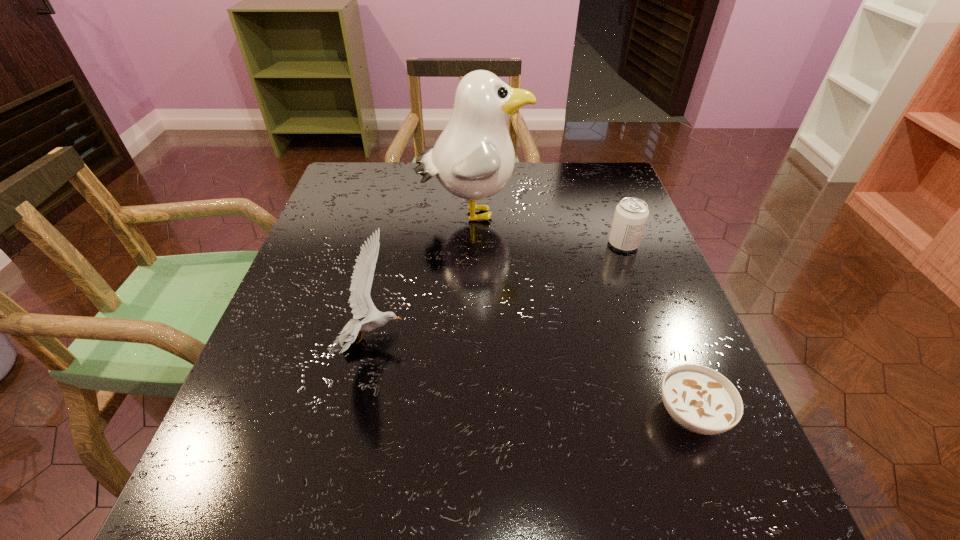
Find the location of a particular element. Image resolution: width=960 pixels, height=540 pixels. free space that is in between the tallest object and the shorter gull is located at coordinates (423, 277).

What are the coordinates of `vacant area that lies between the taller gull and the nearer gull` in the screenshot? It's located at (423, 277).

Locate an element on the screen. The image size is (960, 540). free space between the shortest object and the second tallest object is located at coordinates (532, 377).

Where is `unoccupied position between the nearer gull and the soup bowl`? This screenshot has width=960, height=540. unoccupied position between the nearer gull and the soup bowl is located at coordinates (532, 377).

What are the coordinates of `blank region between the shortest object and the taller gull` in the screenshot? It's located at (582, 313).

In order to click on empty space that is in between the soup bowl and the soda can in this screenshot , I will do pos(657,329).

What are the coordinates of `free spot between the third tallest object and the second tallest object` in the screenshot? It's located at (498, 292).

Find the location of `vacant region between the soda can and the soup bowl`. vacant region between the soda can and the soup bowl is located at coordinates (657, 329).

You are a GUI agent. You are given a task and a screenshot of the screen. Output one action in this format:
    pyautogui.click(x=<x>, y=<y>)
    Task: Click on the free point between the taller gull and the soup bowl
    
    Given the screenshot: What is the action you would take?
    pyautogui.click(x=582, y=313)

Identify the location of vacant area between the second tallest object and the shortest object. Image resolution: width=960 pixels, height=540 pixels. (532, 377).